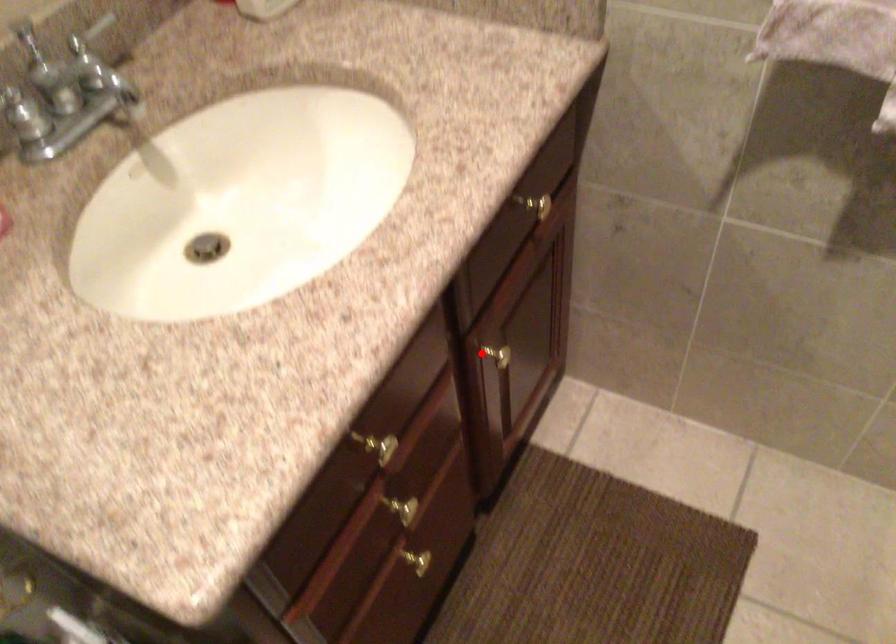
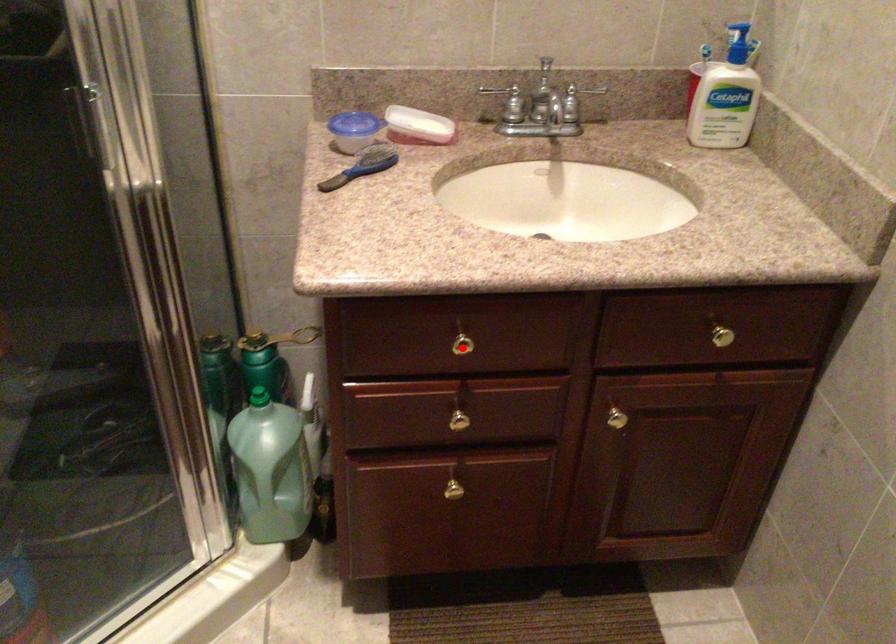
I am providing you with two images of the same scene from different viewpoints. A red point is marked on the first image and another point is marked on the second image. Is the marked point in image1 the same physical position as the marked point in image2?

No